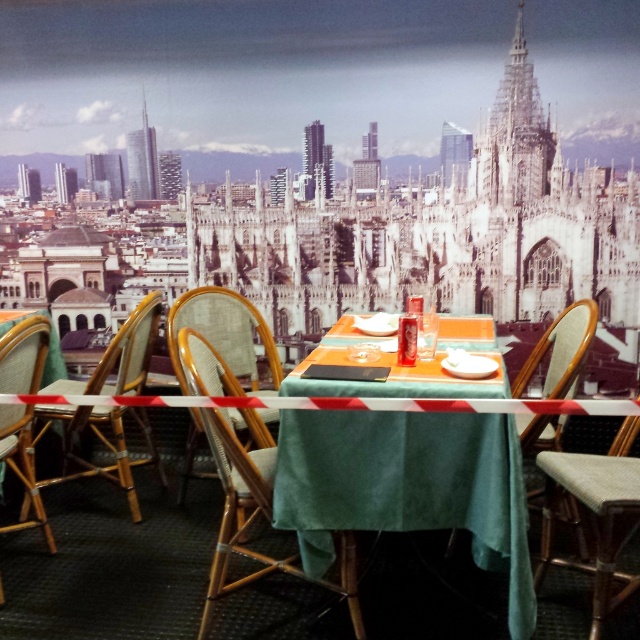
Question: Which of the following is the closest to the observer?

Choices:
 (A) (348, 536)
 (B) (273, 371)
 (C) (291, 429)

Answer: (C)

Question: Can you confirm if green velvet table at center is positioned below woven wood chair at center?

Choices:
 (A) no
 (B) yes

Answer: (A)

Question: Which object is positioned closest to the rattan chair at left?

Choices:
 (A) woven wood chair at center
 (B) woven fabric chair at center

Answer: (B)

Question: Is woven wood chair at center positioned in front of wooden chair at left?

Choices:
 (A) yes
 (B) no

Answer: (A)

Question: Does woven wood chair at center come in front of rattan chair at left?

Choices:
 (A) yes
 (B) no

Answer: (A)

Question: Which of the following is the closest to the observer?

Choices:
 (A) rattan chair at left
 (B) wooden chair at left
 (C) wooden chair at right

Answer: (A)